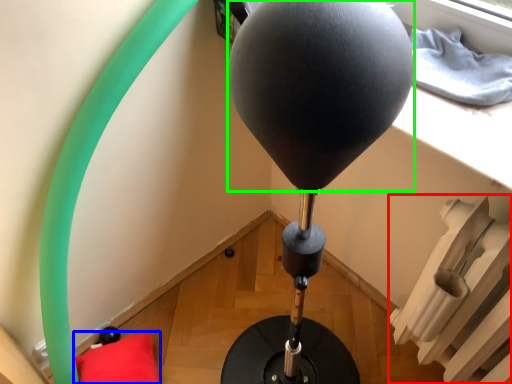
Question: Which object is the farthest from radiator (highlighted by a red box)? Choose among these: pillow (highlighted by a blue box) or balloon (highlighted by a green box).

Choices:
 (A) pillow
 (B) balloon

Answer: (A)